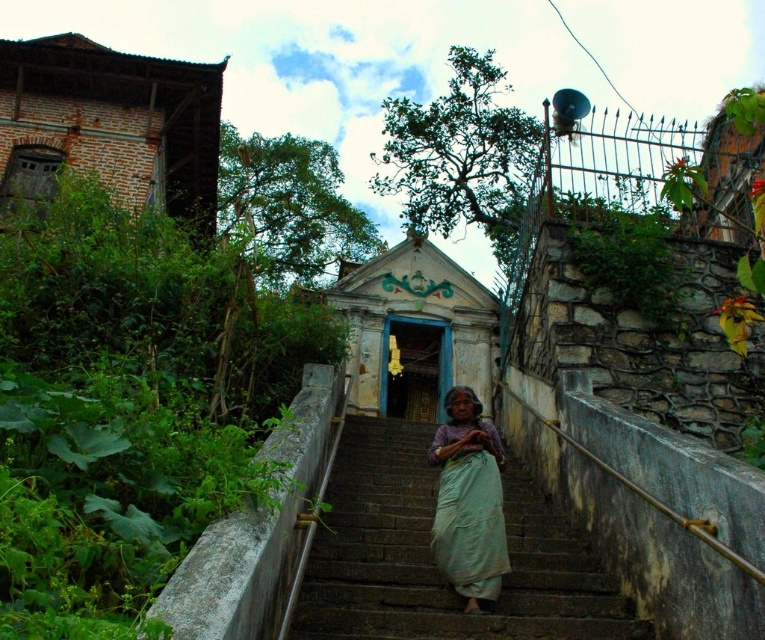
Who is higher up, brown stone stairs at center or light green fabric at center?

light green fabric at center is above.

Can you confirm if brown stone stairs at center is positioned to the right of light green fabric at center?

Incorrect, brown stone stairs at center is not on the right side of light green fabric at center.

Where is `brown stone stairs at center`? This screenshot has width=765, height=640. brown stone stairs at center is located at coordinates (431, 557).

The width and height of the screenshot is (765, 640). What are the coordinates of `brown stone stairs at center` in the screenshot? It's located at (431, 557).